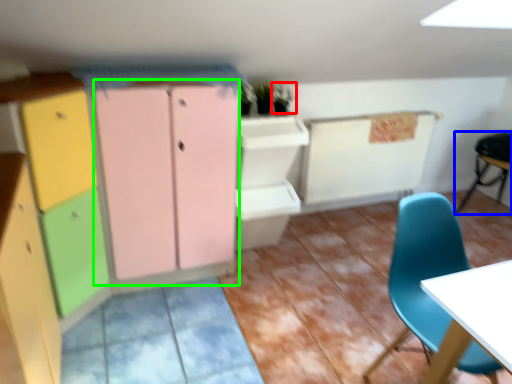
Question: Which object is the closest to the plant (highlighted by a red box)? Choose among these: chair (highlighted by a blue box) or cabinetry (highlighted by a green box).

Choices:
 (A) chair
 (B) cabinetry

Answer: (B)